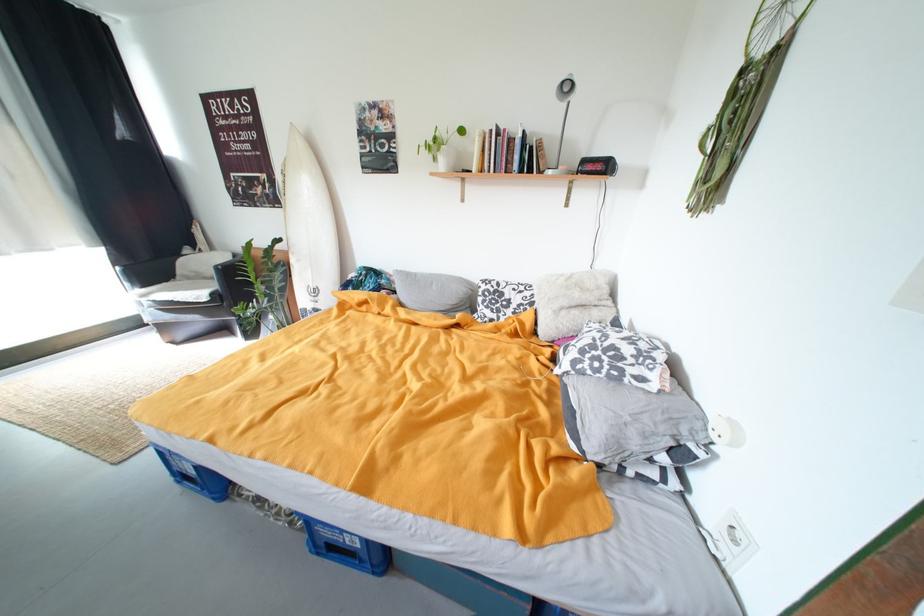
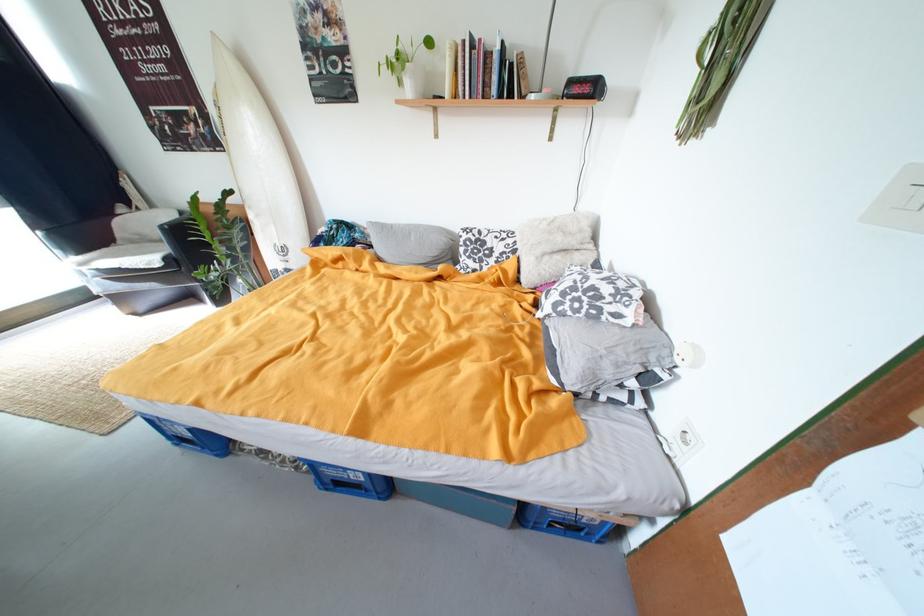
The point at (396, 282) is marked in the first image. Where is the corresponding point in the second image?

(371, 235)